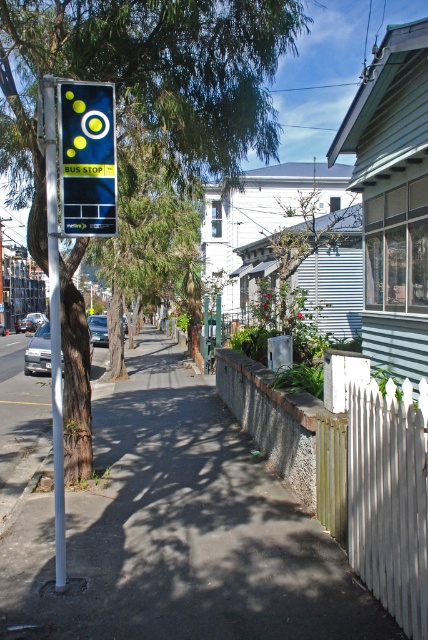
Question: Observing the image, what is the correct spatial positioning of green leafy tree at upper left in reference to matte black sign at upper left?

Choices:
 (A) above
 (B) below

Answer: (A)

Question: Among these points, which one is nearest to the camera?

Choices:
 (A) (88, 67)
 (B) (59, 90)

Answer: (B)

Question: Does matte black sign at upper left appear on the left side of white metallic pole at left?

Choices:
 (A) no
 (B) yes

Answer: (A)

Question: Among these points, which one is farthest from the camera?

Choices:
 (A) (151, 481)
 (B) (58, 285)
 (C) (20, 3)

Answer: (A)

Question: Which of the following is the closest to the observer?

Choices:
 (A) 199,13
 (B) 196,392
 (C) 48,157
 (D) 77,179

Answer: (C)

Question: Does smooth concrete pavement at center appear under green leafy tree at upper left?

Choices:
 (A) yes
 (B) no

Answer: (A)